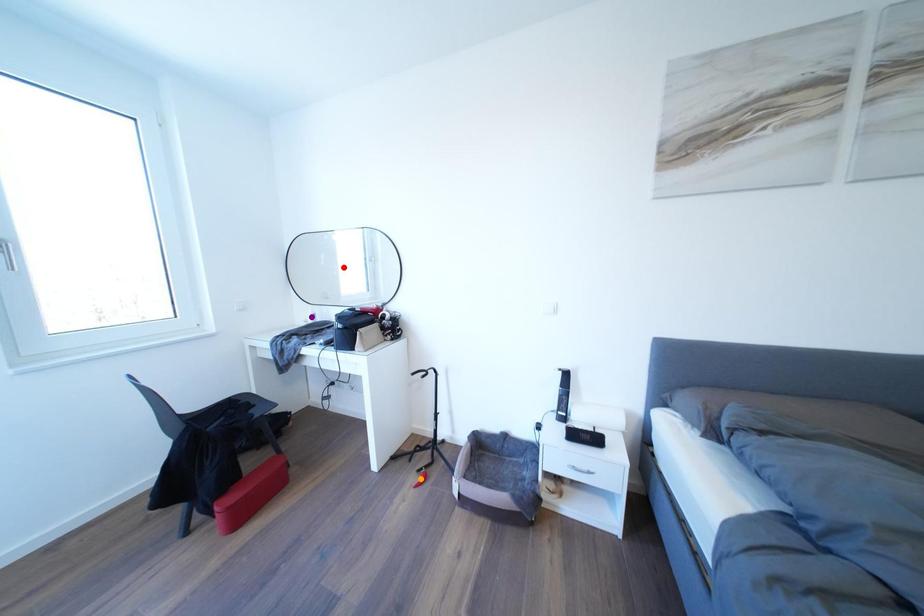
Order these from nearest to farthest:
red point | orange point | purple point

purple point, orange point, red point